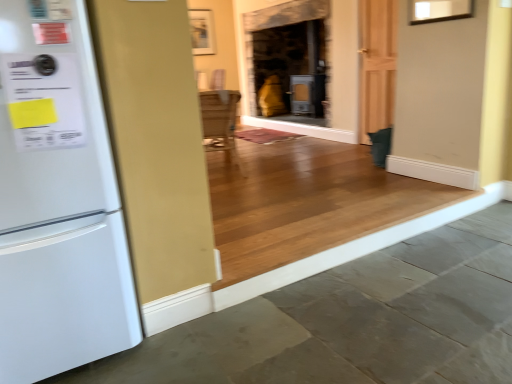
Question: Considering the relative positions of gray concrete at lower left and wooden frame at upper center in the image provided, is gray concrete at lower left to the left or to the right of wooden frame at upper center?

Choices:
 (A) left
 (B) right

Answer: (B)

Question: Considering the positions of gray concrete at lower left and wooden frame at upper center in the image, is gray concrete at lower left taller or shorter than wooden frame at upper center?

Choices:
 (A) tall
 (B) short

Answer: (B)

Question: Considering the real-world distances, which object is closest to the white matte refrigerator at left?

Choices:
 (A) gray concrete at lower left
 (B) wooden frame at upper center

Answer: (A)

Question: Considering the real-world distances, which object is farthest from the white matte refrigerator at left?

Choices:
 (A) wooden frame at upper center
 (B) gray concrete at lower left

Answer: (A)